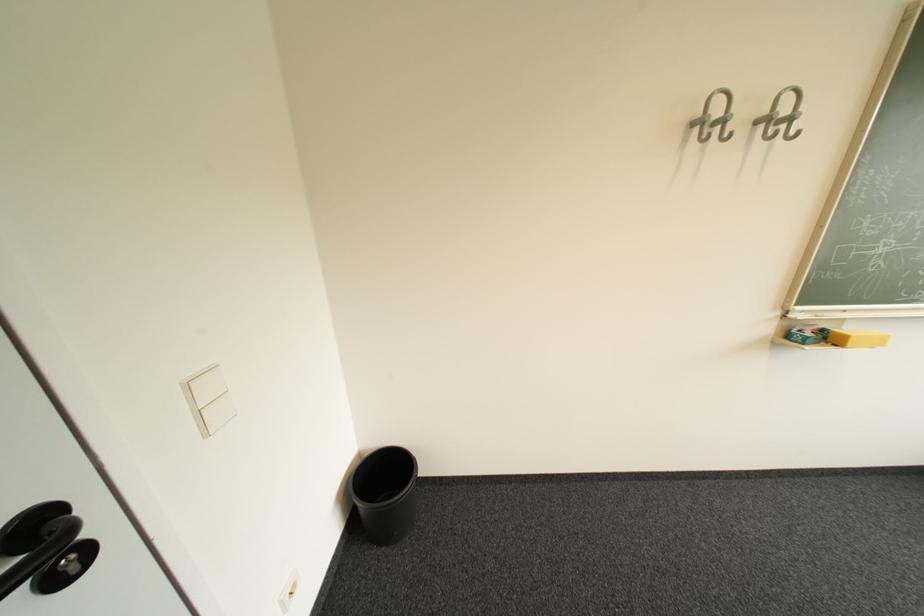
Locate an element on the screen. the top white light switch is located at coordinates point(210,384).